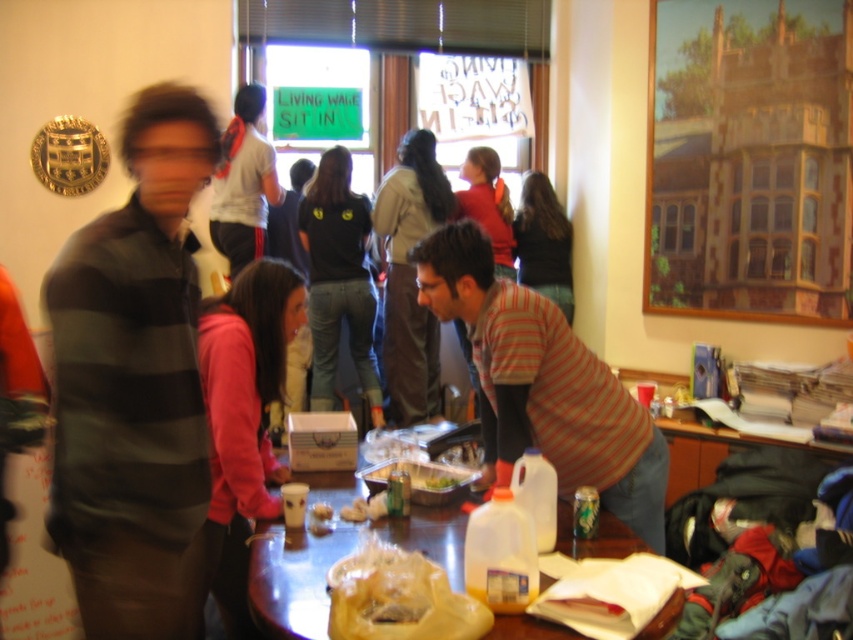
Question: From the image, what is the correct spatial relationship of striped cotton shirt at left in relation to translucent plastic bag at center?

Choices:
 (A) right
 (B) left

Answer: (B)

Question: Is translucent plastic bag at center positioned before smooth plastic container at table center?

Choices:
 (A) yes
 (B) no

Answer: (B)

Question: Which point is farther from the camera taking this photo?

Choices:
 (A) (318, 513)
 (B) (438, 272)

Answer: (B)

Question: Is striped cotton shirt at left wider than smooth plastic container at table center?

Choices:
 (A) no
 (B) yes

Answer: (B)

Question: Which object is the farthest from the striped cotton shirt at center?

Choices:
 (A) smooth plastic container at table center
 (B) translucent plastic table at center
 (C) striped cotton shirt at left

Answer: (C)

Question: Among these objects, which one is nearest to the camera?

Choices:
 (A) translucent plastic table at center
 (B) translucent plastic bag at center

Answer: (A)